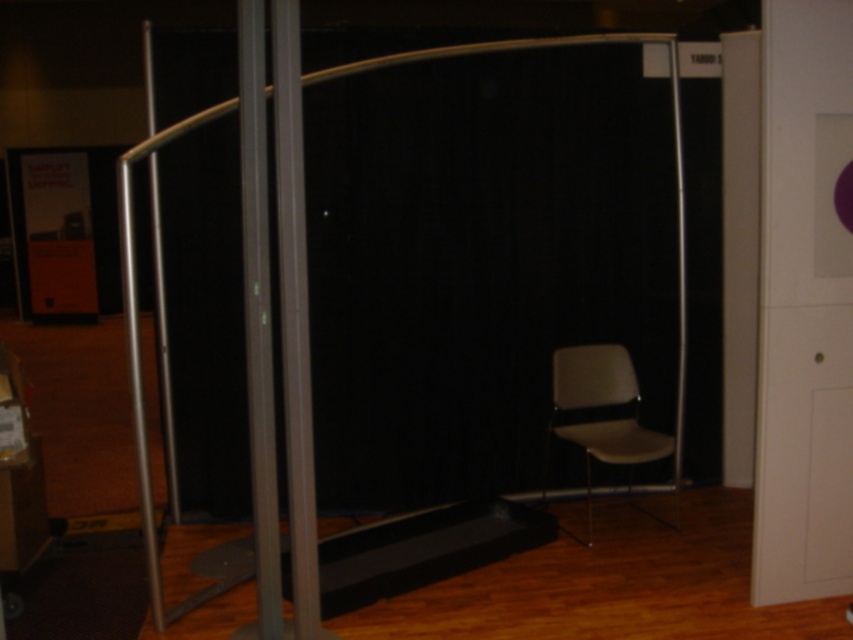
You are standing in the conference room and want to move from the point at coordinates (300, 140) to the point at coordinates (676, 448). Given the presence of the curved metallic divider and the chair behind the black curtain, will your path be obstructed by the divider?

Point (676, 448) is behind point (300, 140), so moving from point (300, 140) to point (676, 448) would mean moving towards the divider. Since the divider is a curved metallic structure blocking the path, your route might be obstructed by the divider.

You are setting up a presentation in the conference room and need to position a projector. The projector requires a mounting point that is higher than the gray plastic swivel chair at right. Can the metallic silver pole at center provide a suitable mounting point?

The metallic silver pole at center is above the gray plastic swivel chair at right, so it can provide a suitable mounting point for the projector as it is positioned higher than the chair.

You are in a room and need to exit through the transparent glass door at center. There is a metallic gray pole at center in your way. Which direction should you move to avoid the pole and reach the door?

You should move to the left side to avoid the metallic gray pole at center and reach the transparent glass door at center, since the door is positioned to the left of the pole.